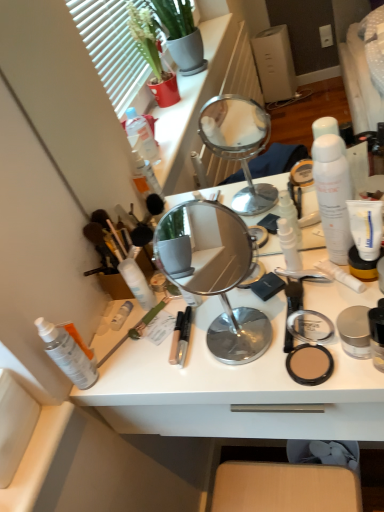
Identify the location of free space between white matte spray can at left, marked as the fifth toiletry in a right-to-left arrangement, and white matte tube at right, the first toothpaste when ordered from bottom to top. point(229,318).